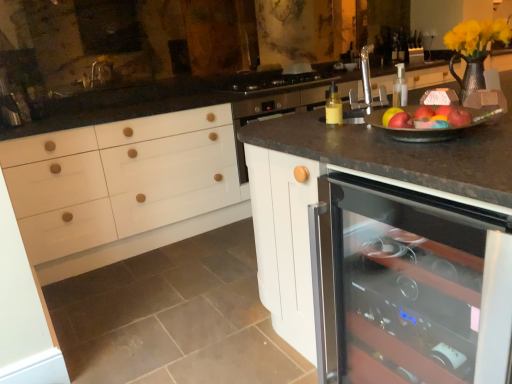
Question: From a real-world perspective, is red matte apple at upper right, the 3th apple in the left-to-right sequence, physically located above or below yellow matte flower at upper right?

Choices:
 (A) above
 (B) below

Answer: (B)

Question: In the image, is red matte apple at upper right, the 3th apple in the left-to-right sequence, positioned in front of or behind yellow matte flower at upper right?

Choices:
 (A) behind
 (B) front

Answer: (B)

Question: Based on their relative distances, which object is farther from the yellow matte bottle at right?

Choices:
 (A) red matte apple at upper right, the 3th apple in the left-to-right sequence
 (B) transparent glass wine cooler at center
 (C) red matte apple at upper right, arranged as the first apple when viewed from the left
 (D) red matte apple at right, marked as the 2th apple in a left-to-right arrangement
 (E) yellow matte flower at upper right

Answer: (B)

Question: Which object is the closest to the red matte apple at upper right, the 3th apple viewed from the right?

Choices:
 (A) yellow matte bottle at right
 (B) red matte apple at right, which is the 2th apple in right-to-left order
 (C) black glass gas stove at center
 (D) red matte apple at upper right, the 3th apple in the left-to-right sequence
 (E) yellow matte flower at upper right

Answer: (B)